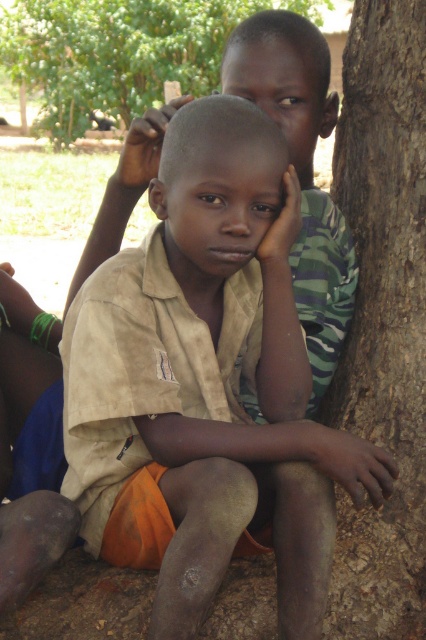
Question: Which object appears farthest from the camera in this image?

Choices:
 (A) brown rough tree trunk at upper right
 (B) brown rough tree trunk at right
 (C) tan cotton shirt at center

Answer: (A)

Question: Which object is the closest to the brown rough tree trunk at upper right?

Choices:
 (A) tan cotton shirt at center
 (B) brown rough tree trunk at right

Answer: (B)

Question: Which object appears closest to the camera in this image?

Choices:
 (A) brown rough tree trunk at upper right
 (B) tan cotton shirt at center

Answer: (B)

Question: Can you confirm if tan cotton shirt at center is positioned above brown rough tree trunk at upper right?

Choices:
 (A) no
 (B) yes

Answer: (A)

Question: Does brown rough tree trunk at right have a larger size compared to brown rough tree trunk at upper right?

Choices:
 (A) yes
 (B) no

Answer: (B)

Question: Is tan cotton shirt at center thinner than brown rough tree trunk at upper right?

Choices:
 (A) yes
 (B) no

Answer: (A)